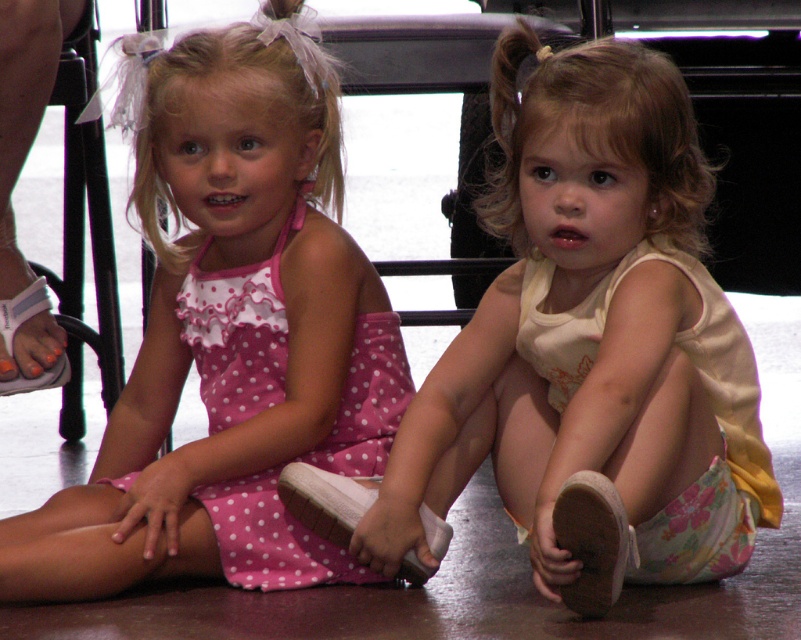
Who is positioned more to the left, white fabric dress at center or white fabric shoe at lower right?

white fabric dress at center

Is point (544, 134) farther from camera compared to point (590, 570)?

Yes, point (544, 134) is behind point (590, 570).

Does point (465, 403) come closer to viewer compared to point (602, 484)?

No, (465, 403) is behind (602, 484).

Locate an element on the screen. The height and width of the screenshot is (640, 801). white fabric dress at center is located at coordinates (582, 340).

What do you see at coordinates (594, 541) in the screenshot? The image size is (801, 640). I see `white fabric shoe at lower right` at bounding box center [594, 541].

Locate an element on the screen. white fabric shoe at lower right is located at coordinates pyautogui.click(x=594, y=541).

Can you confirm if white fabric shoe at lower right is positioned to the left of white fabric sandal at left?

In fact, white fabric shoe at lower right is to the right of white fabric sandal at left.

Where is `white fabric shoe at lower right`? white fabric shoe at lower right is located at coordinates (594, 541).

Based on the photo, who is more distant from viewer, (562,508) or (59,365)?

Point (59,365)

Where is `white fabric shoe at lower right`? This screenshot has width=801, height=640. white fabric shoe at lower right is located at coordinates (594, 541).